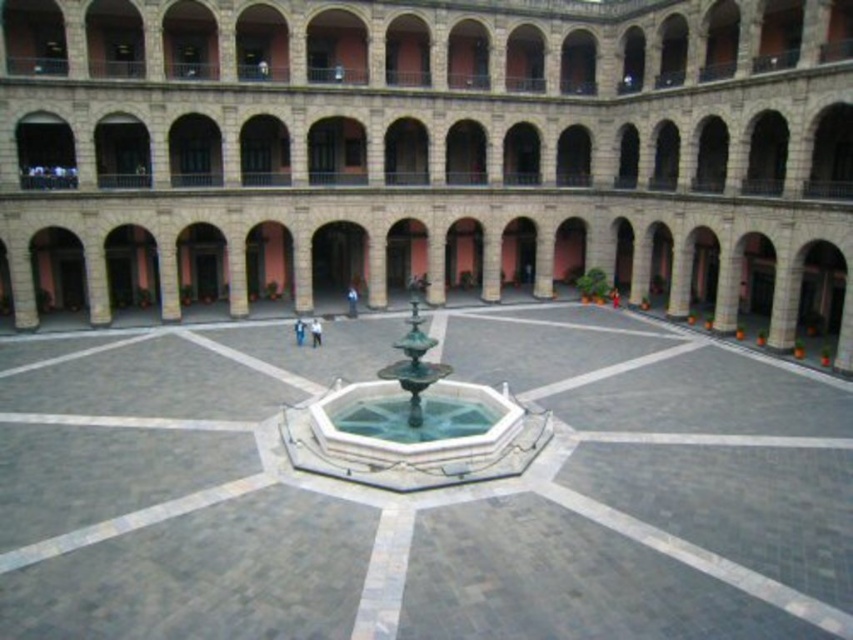
Question: Considering the relative positions of gray stone fountain at center and polished stone fountain at center in the image provided, where is gray stone fountain at center located with respect to polished stone fountain at center?

Choices:
 (A) below
 (B) above

Answer: (B)

Question: Based on their relative distances, which object is farther from the green marble fountain at center?

Choices:
 (A) gray stone fountain at center
 (B) polished stone fountain at center

Answer: (A)

Question: Which object is farther from the camera taking this photo?

Choices:
 (A) polished stone fountain at center
 (B) green marble fountain at center

Answer: (B)

Question: Does polished stone fountain at center have a lesser width compared to green marble fountain at center?

Choices:
 (A) no
 (B) yes

Answer: (A)

Question: Which point is farther from the camera taking this photo?

Choices:
 (A) [x=180, y=476]
 (B) [x=335, y=452]
 (C) [x=166, y=284]

Answer: (C)

Question: Can you confirm if gray stone fountain at center is bigger than polished stone fountain at center?

Choices:
 (A) no
 (B) yes

Answer: (B)